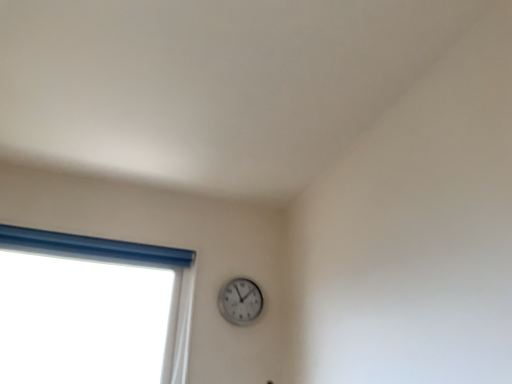
Question: From the image's perspective, is white plastic window at left located above or below white plastic wall clock at upper center?

Choices:
 (A) above
 (B) below

Answer: (B)

Question: Would you say white plastic window at left is to the left or to the right of white plastic wall clock at upper center in the picture?

Choices:
 (A) right
 (B) left

Answer: (B)

Question: Looking at their shapes, would you say white plastic window at left is wider or thinner than white plastic wall clock at upper center?

Choices:
 (A) wide
 (B) thin

Answer: (A)

Question: Is white plastic wall clock at upper center situated inside white plastic window at left or outside?

Choices:
 (A) outside
 (B) inside

Answer: (A)

Question: Considering the positions of white plastic wall clock at upper center and white plastic window at left in the image, is white plastic wall clock at upper center taller or shorter than white plastic window at left?

Choices:
 (A) short
 (B) tall

Answer: (A)

Question: From a real-world perspective, is white plastic wall clock at upper center physically located above or below white plastic window at left?

Choices:
 (A) above
 (B) below

Answer: (A)

Question: Considering their positions, is white plastic wall clock at upper center located in front of or behind white plastic window at left?

Choices:
 (A) behind
 (B) front

Answer: (A)